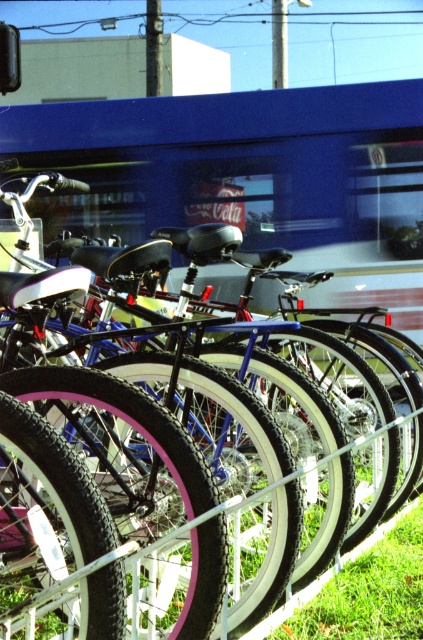
Question: Which point is farther to the camera?

Choices:
 (A) (104, 365)
 (B) (354, 221)

Answer: (B)

Question: Does blue reflective train at center appear on the left side of pink rubber bicycle at center?

Choices:
 (A) yes
 (B) no

Answer: (B)

Question: Which point is closer to the camera taking this photo?

Choices:
 (A) (397, 179)
 (B) (288, 364)

Answer: (B)

Question: Can you confirm if blue reflective train at center is positioned to the right of pink rubber bicycle at center?

Choices:
 (A) no
 (B) yes

Answer: (B)

Question: From the image, what is the correct spatial relationship of blue reflective train at center in relation to pink rubber bicycle at center?

Choices:
 (A) left
 (B) right

Answer: (B)